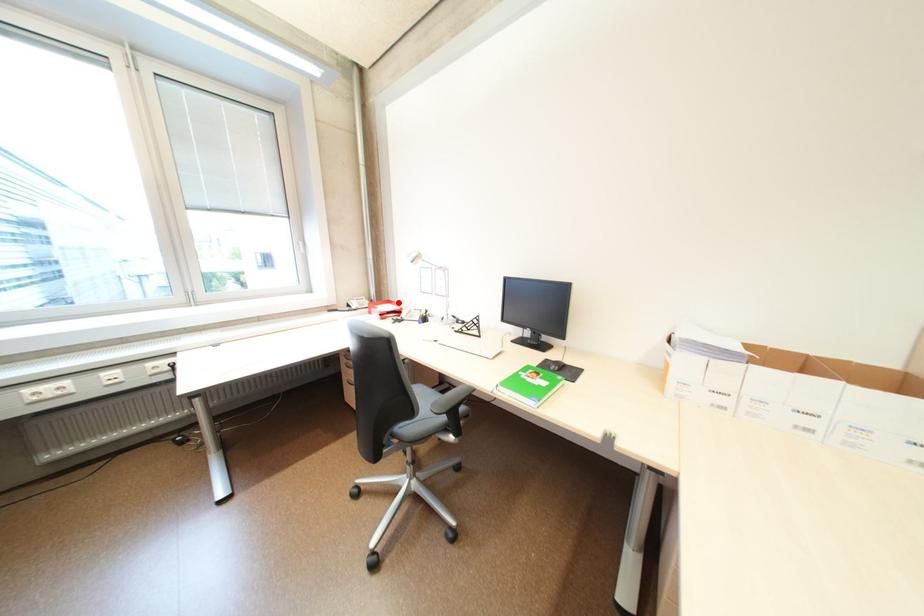
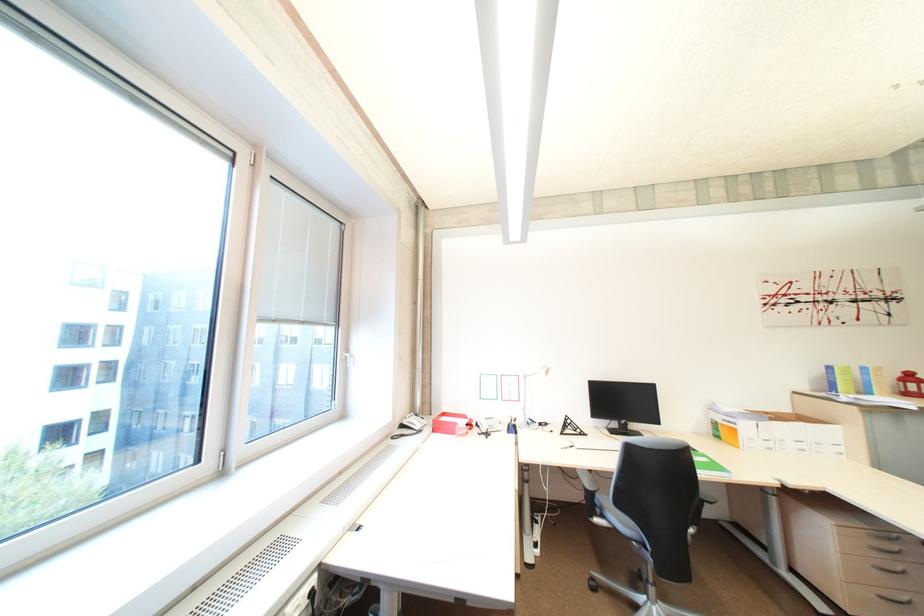
Question: I am providing you with two images of the same scene from different viewpoints. Given a red point in image1, look at the same physical point in image2. Is it:

Choices:
 (A) Closer to the viewpoint
 (B) Farther from the viewpoint

Answer: (B)